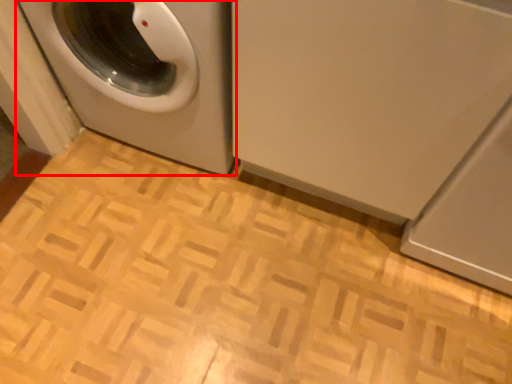
Question: From the image's perspective, where is washing machine (annotated by the red box) located in relation to washing machine in the image?

Choices:
 (A) above
 (B) below

Answer: (A)